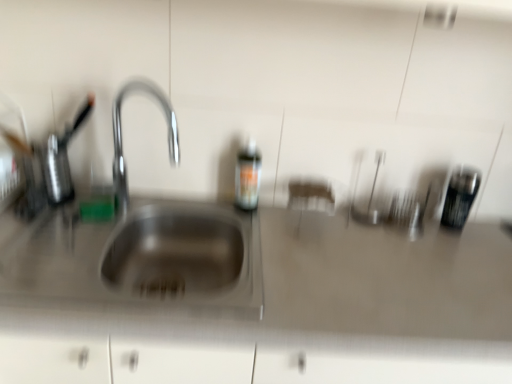
The height and width of the screenshot is (384, 512). I want to click on vacant area located to the right-hand side of translucent plastic bottle at center, so pyautogui.click(x=289, y=219).